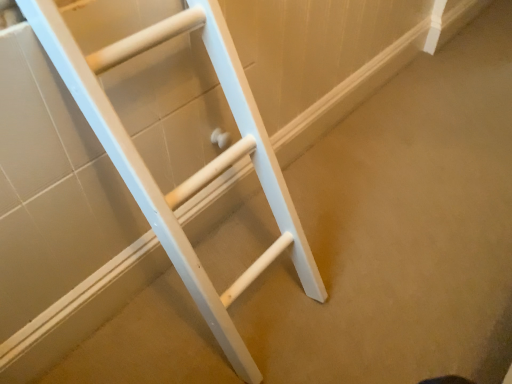
In order to click on white wooden ladder at center in this screenshot , I will do `click(196, 172)`.

Describe the element at coordinates (196, 172) in the screenshot. The width and height of the screenshot is (512, 384). I see `white wooden ladder at center` at that location.

Identify the location of white wooden ladder at center. (196, 172).